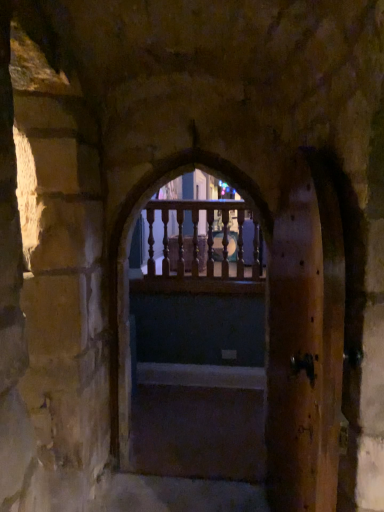
Question: Is brown wooden screen door at right behind transparent wooden railing at center?

Choices:
 (A) no
 (B) yes

Answer: (A)

Question: Is brown wooden screen door at right completely or partially outside of transparent wooden railing at center?

Choices:
 (A) yes
 (B) no

Answer: (A)

Question: Is brown wooden screen door at right facing towards transparent wooden railing at center?

Choices:
 (A) no
 (B) yes

Answer: (A)

Question: Considering the relative sizes of brown wooden screen door at right and transparent wooden railing at center in the image provided, is brown wooden screen door at right shorter than transparent wooden railing at center?

Choices:
 (A) yes
 (B) no

Answer: (B)

Question: Is transparent wooden railing at center at the back of brown wooden screen door at right?

Choices:
 (A) no
 (B) yes

Answer: (A)

Question: Based on their sizes in the image, would you say dark wood stairs at center is bigger or smaller than wooden railing at center?

Choices:
 (A) big
 (B) small

Answer: (B)

Question: Is dark wood stairs at center to the left or to the right of wooden railing at center in the image?

Choices:
 (A) right
 (B) left

Answer: (B)

Question: Considering the positions of point (230, 433) and point (230, 420), is point (230, 433) closer or farther from the camera than point (230, 420)?

Choices:
 (A) closer
 (B) farther

Answer: (A)

Question: In terms of width, does dark wood stairs at center look wider or thinner when compared to wooden railing at center?

Choices:
 (A) thin
 (B) wide

Answer: (B)

Question: Looking at the image, does wooden railing at center seem bigger or smaller compared to brown wooden screen door at right?

Choices:
 (A) big
 (B) small

Answer: (A)

Question: From a real-world perspective, is wooden railing at center positioned above or below brown wooden screen door at right?

Choices:
 (A) above
 (B) below

Answer: (A)

Question: Is wooden railing at center to the left or to the right of brown wooden screen door at right in the image?

Choices:
 (A) right
 (B) left

Answer: (B)

Question: From the image's perspective, is wooden railing at center located above or below brown wooden screen door at right?

Choices:
 (A) below
 (B) above

Answer: (B)

Question: In terms of size, does wooden railing at center appear bigger or smaller than dark wood stairs at center?

Choices:
 (A) small
 (B) big

Answer: (B)

Question: In terms of height, does wooden railing at center look taller or shorter compared to dark wood stairs at center?

Choices:
 (A) tall
 (B) short

Answer: (A)